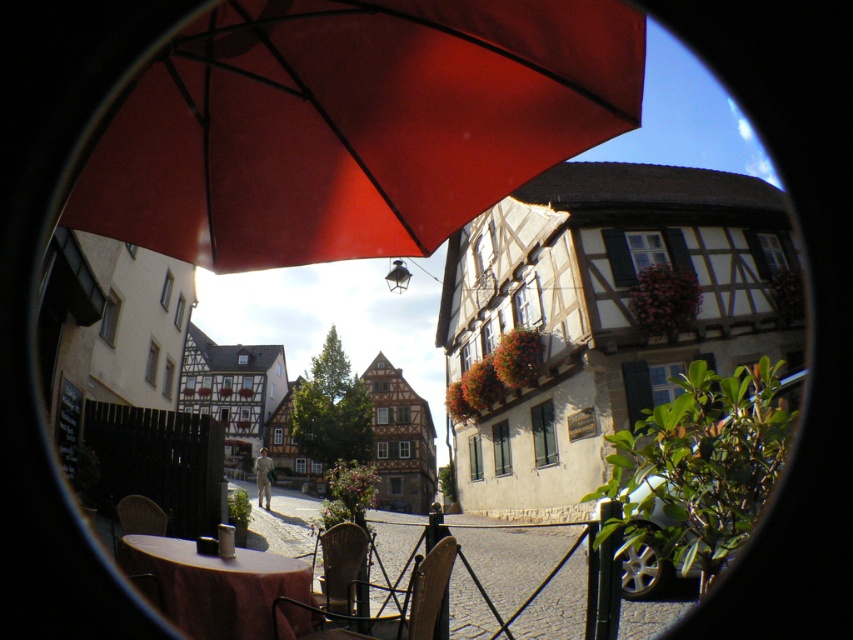
You are a tourist standing in front of the outdoor cafe table with a pinkish red tablecloth. You want to sit on the closest chair to you. Which chair should you choose between the metallic brown chair at center and the rattan chair at lower left?

The metallic brown chair at center is closer to the viewer than the rattan chair at lower left, so you should choose the metallic brown chair at center.

You are a tourist standing at the entrance of the smooth stone alley at center and want to find the brown fabric table at lower left. Which direction should you turn to locate it?

The smooth stone alley at center is to the right of the brown fabric table at lower left, so you should turn to your left to locate the brown fabric table at lower left.